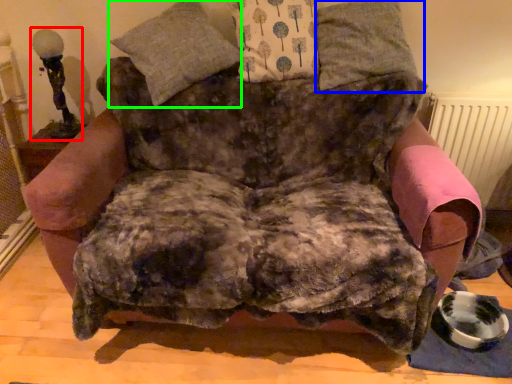
Question: Estimate the real-world distances between objects in this image. Which object is closer to table lamp (highlighted by a red box), pillow (highlighted by a blue box) or pillow (highlighted by a green box)?

Choices:
 (A) pillow
 (B) pillow

Answer: (B)